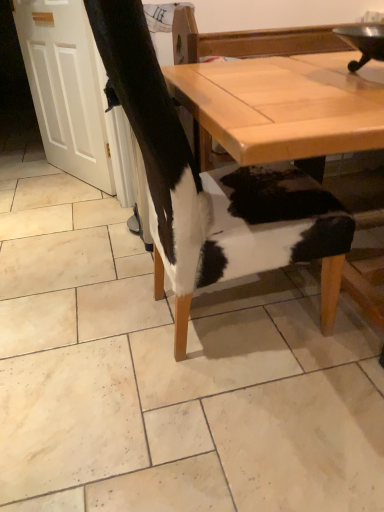
What is the approximate width of cowhide at center?

13.59 inches.

The width and height of the screenshot is (384, 512). Identify the location of cowhide at center. (155, 139).

Locate an element on the screen. Image resolution: width=384 pixels, height=512 pixels. light brown wooden table at center is located at coordinates (284, 106).

This screenshot has width=384, height=512. In order to click on cowhide chair at center in this screenshot , I will do `click(170, 374)`.

From the image's perspective, which object appears higher, cowhide chair at center or cowhide at center?

cowhide at center appears higher in the image.

Is cowhide chair at center positioned behind cowhide at center?

No, cowhide chair at center is closer to the camera.

In the scene shown: Which object is thinner, cowhide chair at center or cowhide at center?

With smaller width is cowhide at center.

Is cowhide chair at center at the left side of cowhide at center?

In fact, cowhide chair at center is to the right of cowhide at center.

Does cowhide at center turn towards cowhide chair at center?

No, cowhide at center is not aimed at cowhide chair at center.

Choose the correct answer: Is cowhide at center inside cowhide chair at center or outside it?

cowhide at center is not enclosed by cowhide chair at center.

Is cowhide at center at the right side of cowhide chair at center?

In fact, cowhide at center is to the left of cowhide chair at center.

Considering the positions of point (113, 1) and point (1, 492), is point (113, 1) closer or farther from the camera than point (1, 492)?

Point (113, 1) is positioned closer to the camera compared to point (1, 492).

Does point (337, 134) come behind point (132, 364)?

No, it is in front of (132, 364).

Locate an element on the screen. This screenshot has height=512, width=384. tile that is on the left side of light brown wooden table at center is located at coordinates (170, 374).

Between light brown wooden table at center and cowhide chair at center, which one appears on the right side from the viewer's perspective?

light brown wooden table at center.

Is light brown wooden table at center looking in the opposite direction of cowhide at center?

light brown wooden table at center does not have its back to cowhide at center.

From a real-world perspective, is light brown wooden table at center positioned over cowhide at center based on gravity?

Yes, from a real-world perspective, light brown wooden table at center is above cowhide at center.

Can you confirm if light brown wooden table at center is bigger than cowhide at center?

Yes, light brown wooden table at center is bigger than cowhide at center.

Is cowhide chair at center to the left of light brown wooden table at center from the viewer's perspective?

Yes, cowhide chair at center is to the left of light brown wooden table at center.

In the image, there is a light brown wooden table at center. Where is `tile below it (from the image's perspective)`? tile below it (from the image's perspective) is located at coordinates (170, 374).

Is cowhide chair at center bigger or smaller than light brown wooden table at center?

cowhide chair at center is smaller than light brown wooden table at center.

Which of these two, cowhide chair at center or light brown wooden table at center, stands taller?

light brown wooden table at center is taller.

Based on the photo, considering the relative sizes of cowhide chair at center and cowhide chair at center in the image provided, is cowhide chair at center taller than cowhide chair at center?

Yes.

Looking at this image, from the image's perspective, which one is positioned higher, cowhide chair at center or cowhide chair at center?

cowhide chair at center.

Consider the image. Is cowhide chair at center surrounding cowhide chair at center?

No, cowhide chair at center is not inside cowhide chair at center.

Would you say cowhide chair at center is a long distance from cowhide at center?

No, there isn't a large distance between cowhide chair at center and cowhide at center.

Is cowhide chair at center facing away from cowhide at center?

No.

Can you confirm if cowhide chair at center is thinner than cowhide at center?

No, cowhide chair at center is not thinner than cowhide at center.

Image resolution: width=384 pixels, height=512 pixels. Identify the location of leg below the cowhide chair at center (from a real-world perspective). (155, 139).

Find the location of a particular element. The width and height of the screenshot is (384, 512). tile lying in front of the cowhide at center is located at coordinates (170, 374).

The width and height of the screenshot is (384, 512). What are the coordinates of `tile on the right side of cowhide at center` in the screenshot? It's located at (170, 374).

From the image, which object appears to be nearer to cowhide at center, cowhide chair at center or light brown wooden table at center?

Among the two, cowhide chair at center is located nearer to cowhide at center.

Looking at the image, which one is located closer to cowhide chair at center, cowhide chair at center or light brown wooden table at center?

Result: Among the two, cowhide chair at center is located nearer to cowhide chair at center.

Estimate the real-world distances between objects in this image. Which object is further from cowhide chair at center, cowhide at center or cowhide chair at center?

Based on the image, cowhide at center appears to be further to cowhide chair at center.

Consider the image. When comparing their distances from cowhide at center, does cowhide chair at center or cowhide chair at center seem closer?

cowhide chair at center lies closer to cowhide at center than the other object.

Looking at the image, which one is located further to cowhide chair at center, cowhide at center or cowhide chair at center?

Based on the image, cowhide chair at center appears to be further to cowhide chair at center.

Considering their positions, is light brown wooden table at center positioned closer to cowhide chair at center than cowhide at center?

The object closer to cowhide chair at center is cowhide at center.

Looking at the image, which one is located further to cowhide at center, light brown wooden table at center or cowhide chair at center?

light brown wooden table at center lies further to cowhide at center than the other object.

In the scene shown: From the image, which object appears to be nearer to cowhide chair at center, cowhide chair at center or cowhide at center?

The object closer to cowhide chair at center is cowhide at center.

Locate an element on the screen. The height and width of the screenshot is (512, 384). chair between light brown wooden table at center and cowhide chair at center from top to bottom is located at coordinates (159, 147).

Where is `table between cowhide chair at center and cowhide at center along the z-axis`? table between cowhide chair at center and cowhide at center along the z-axis is located at coordinates (284, 106).

You are a GUI agent. You are given a task and a screenshot of the screen. Output one action in this format:
    pyautogui.click(x=<x>, y=<y>)
    Task: Click on the tile located between cowhide chair at center and cowhide at center in the depth direction
    The height and width of the screenshot is (512, 384).
    Given the screenshot: What is the action you would take?
    pyautogui.click(x=170, y=374)

Find the location of a particular element. table between cowhide chair at center and cowhide at center from front to back is located at coordinates (284, 106).